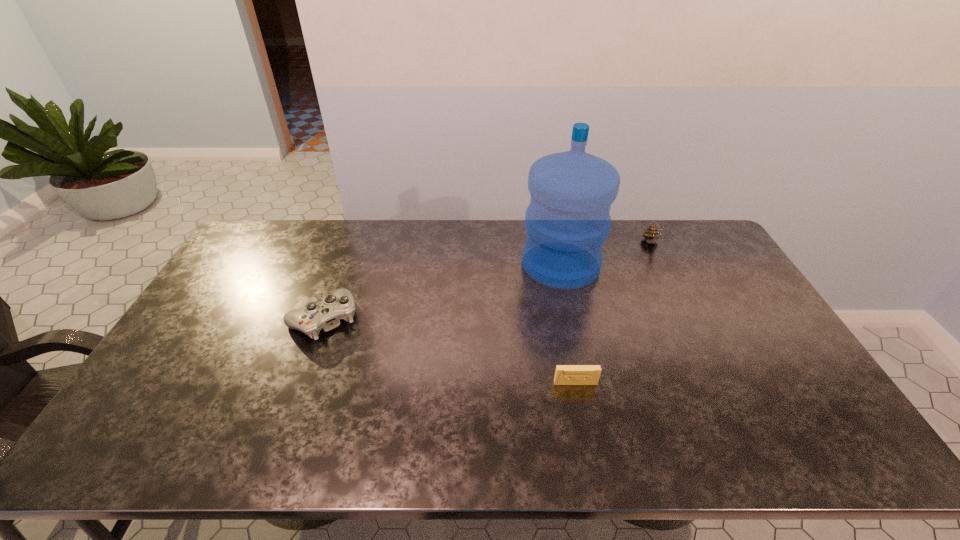
Locate which object ranks second in proximity to the leftmost object. Please provide its 2D coordinates. Your answer should be formatted as a tuple, i.e. [(x, y)], where the tuple contains the x and y coordinates of a point satisfying the conditions above.

[(565, 374)]